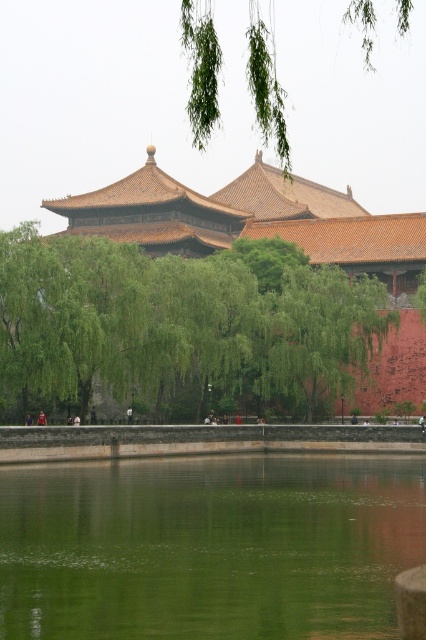
Question: Which is nearer to the green leafy branches at upper center?

Choices:
 (A) green leafy tree at center
 (B) green reflective water at center

Answer: (A)

Question: From the image, what is the correct spatial relationship of green leafy tree at center in relation to green leafy branches at upper center?

Choices:
 (A) below
 (B) above

Answer: (A)

Question: Does green reflective water at center appear on the left side of green leafy tree at center?

Choices:
 (A) yes
 (B) no

Answer: (B)

Question: Can you confirm if green reflective water at center is bigger than green leafy tree at center?

Choices:
 (A) no
 (B) yes

Answer: (A)

Question: Which point is farther to the camera?

Choices:
 (A) green leafy branches at upper center
 (B) green leafy tree at center

Answer: (B)

Question: Which object is farther from the camera taking this photo?

Choices:
 (A) green leafy tree at center
 (B) green leafy branches at upper center
 (C) green reflective water at center

Answer: (A)